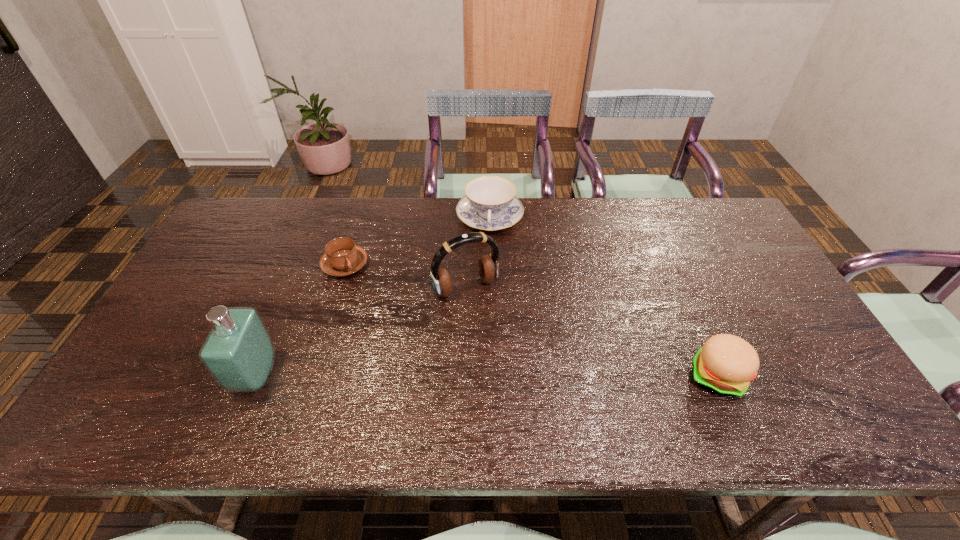
What are the coordinates of `object that is at the far edge` in the screenshot? It's located at (490, 204).

Identify the location of perfume located at the near edge. (239, 353).

Find the location of a particular element. hamburger at the near edge is located at coordinates (725, 365).

Identify the location of vacant space at the far edge of the desktop. The width and height of the screenshot is (960, 540). (529, 220).

Identify the location of free region at the near edge of the desktop. (598, 388).

This screenshot has height=540, width=960. Find the location of `vacant space at the left edge of the desktop`. vacant space at the left edge of the desktop is located at coordinates (195, 341).

This screenshot has width=960, height=540. I want to click on vacant region at the right edge of the desktop, so click(711, 265).

The height and width of the screenshot is (540, 960). I want to click on vacant space at the far left corner of the desktop, so click(217, 238).

The image size is (960, 540). Find the location of `vacant area that lies between the farthest object and the headset`. vacant area that lies between the farthest object and the headset is located at coordinates (478, 253).

Locate an element on the screen. free point between the hamburger and the fourth object from right to left is located at coordinates (531, 321).